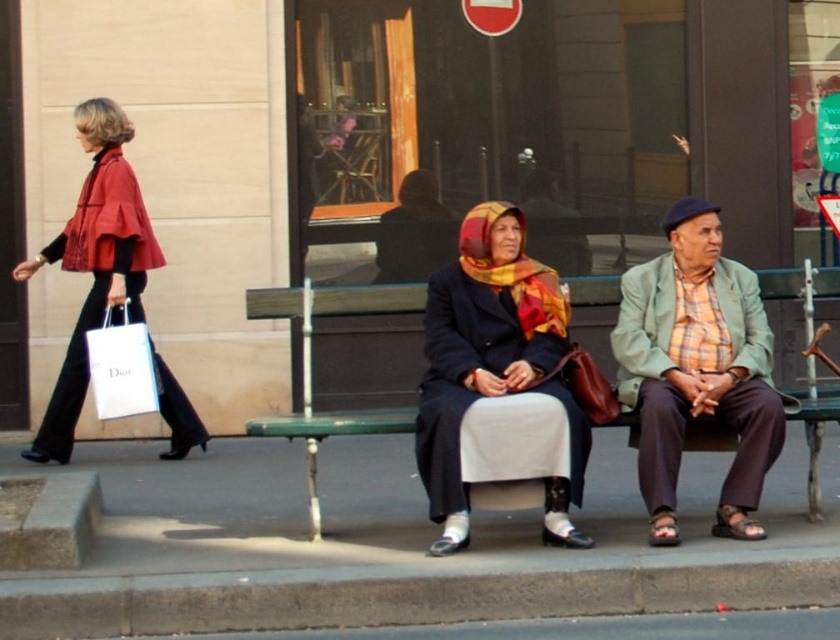
How distant is concrete pavement at lower center from white paper bag at left?

concrete pavement at lower center is 3.65 feet away from white paper bag at left.

Is point (701, 467) in front of point (105, 410)?

No.

Locate an element on the screen. This screenshot has width=840, height=640. concrete pavement at lower center is located at coordinates (403, 547).

I want to click on concrete pavement at lower center, so click(x=403, y=547).

From the picture: Can you confirm if green painted wood bench at center is wider than white paper bag at left?

Correct, the width of green painted wood bench at center exceeds that of white paper bag at left.

Can you confirm if green painted wood bench at center is positioned above white paper bag at left?

No.

Locate an element on the screen. This screenshot has height=640, width=840. green painted wood bench at center is located at coordinates (311, 365).

Does matte red cape at left have a larger size compared to green painted wood bench at center?

Yes, matte red cape at left is bigger than green painted wood bench at center.

Can you confirm if matte red cape at left is wider than green painted wood bench at center?

Yes, matte red cape at left is wider than green painted wood bench at center.

Does point (113, 280) come in front of point (403, 284)?

No, (113, 280) is further to viewer.

You are a GUI agent. You are given a task and a screenshot of the screen. Output one action in this format:
    pyautogui.click(x=<x>, y=<y>)
    Task: Click on the matte red cape at left
    
    Given the screenshot: What is the action you would take?
    pyautogui.click(x=93, y=262)